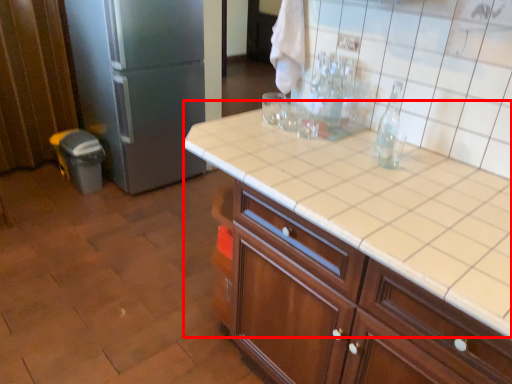
Question: From the image's perspective, where is table (annotated by the red box) located in relation to refrigerator in the image?

Choices:
 (A) below
 (B) above

Answer: (A)